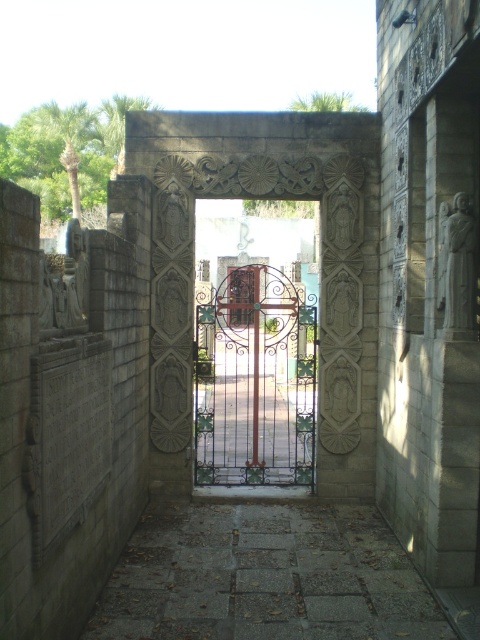
Does carved stone archway at center have a greater height compared to metallic wrought iron gate at center?

No, carved stone archway at center is not taller than metallic wrought iron gate at center.

Between point (156, 198) and point (275, 468), which one is positioned in front?

Point (156, 198)

The width and height of the screenshot is (480, 640). I want to click on carved stone archway at center, so click(x=320, y=266).

The height and width of the screenshot is (640, 480). Identify the location of carved stone archway at center. (320, 266).